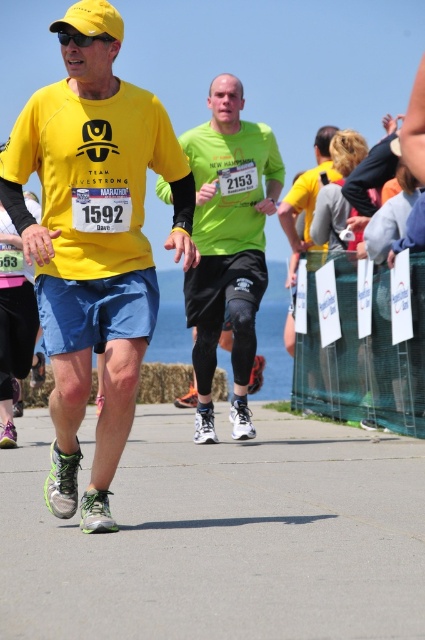
Does green matte running shirt at center have a lesser width compared to matte yellow shirt at center?

No.

Is green matte running shirt at center to the right of matte yellow shirt at center from the viewer's perspective?

No, green matte running shirt at center is not to the right of matte yellow shirt at center.

Between point (210, 292) and point (319, 172), which one is positioned behind?

Point (319, 172)

Where is `green matte running shirt at center`? Image resolution: width=425 pixels, height=640 pixels. green matte running shirt at center is located at coordinates (227, 244).

Is point (118, 177) positioned behind point (286, 211)?

No, (118, 177) is in front of (286, 211).

Can you confirm if matte yellow t-shirt at center is positioned to the right of matte yellow shirt at center?

Incorrect, matte yellow t-shirt at center is not on the right side of matte yellow shirt at center.

Does point (95, 260) come in front of point (306, 202)?

Yes, it is.

You are a GUI agent. You are given a task and a screenshot of the screen. Output one action in this format:
    pyautogui.click(x=<x>, y=<y>)
    Task: Click on the matte yellow t-shirt at center
    This screenshot has width=425, height=640.
    Given the screenshot: What is the action you would take?
    pyautogui.click(x=93, y=241)

Between matte yellow t-shirt at center and green matte running shirt at center, which one appears on the left side from the viewer's perspective?

matte yellow t-shirt at center is more to the left.

How much distance is there between matte yellow t-shirt at center and green matte running shirt at center?

matte yellow t-shirt at center and green matte running shirt at center are 3.12 meters apart.

The height and width of the screenshot is (640, 425). What do you see at coordinates (93, 241) in the screenshot?
I see `matte yellow t-shirt at center` at bounding box center [93, 241].

The height and width of the screenshot is (640, 425). Identify the location of matte yellow t-shirt at center. (93, 241).